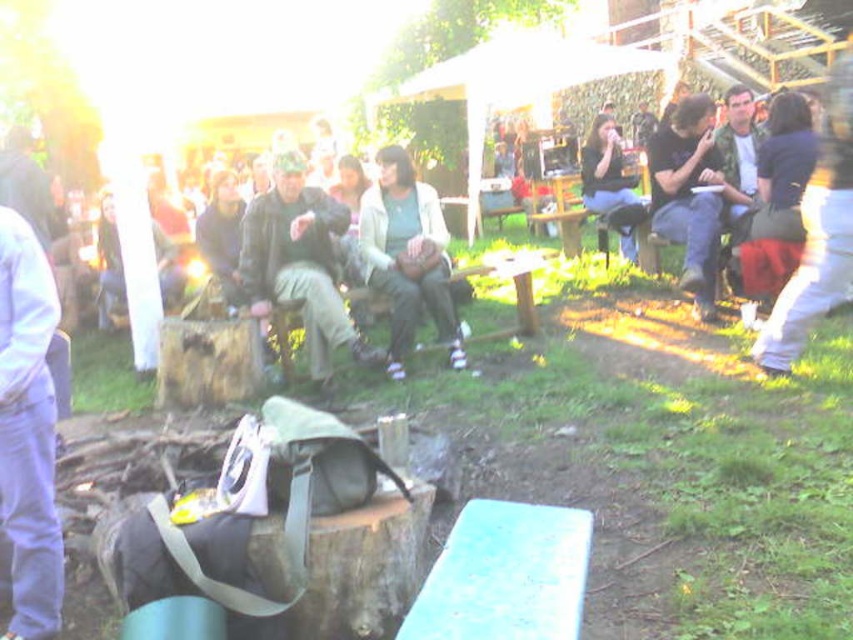
Does camouflage jacket at center have a lesser width compared to light beige sweater at center?

In fact, camouflage jacket at center might be wider than light beige sweater at center.

Does point (277, 160) come closer to viewer compared to point (451, 356)?

Yes, it is.

At what (x,y) coordinates should I click in order to perform the action: click on camouflage jacket at center. Please return your answer as a coordinate pair (x, y). The height and width of the screenshot is (640, 853). Looking at the image, I should click on (300, 260).